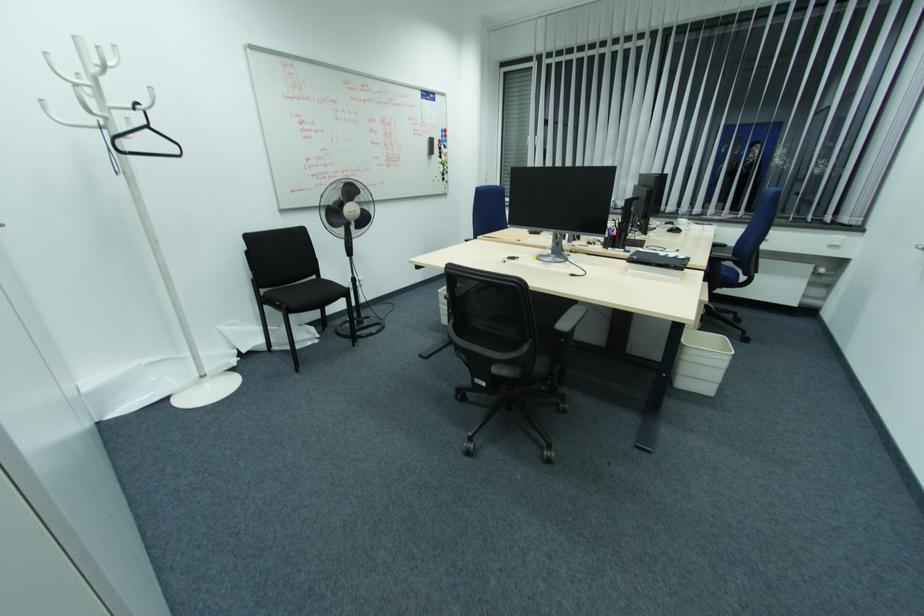
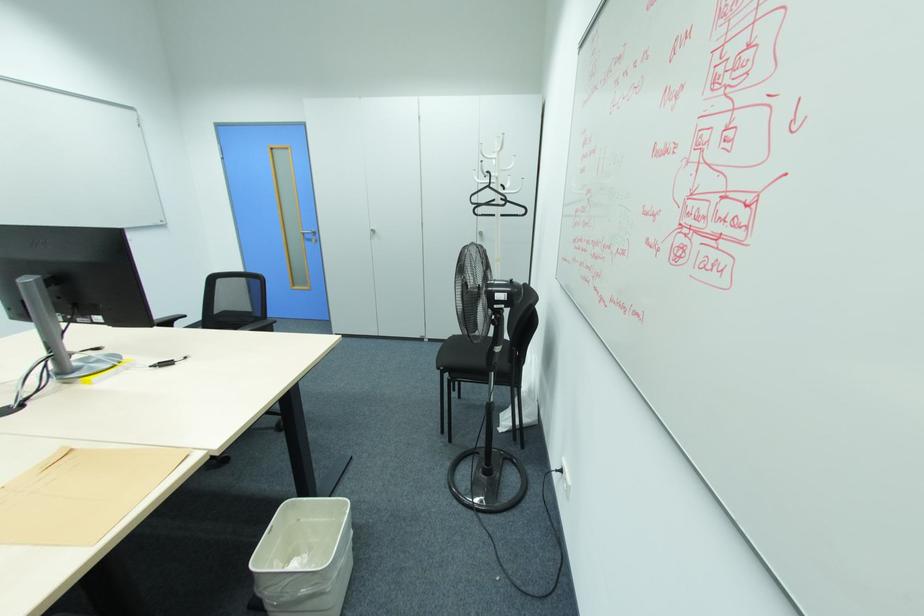
The point at (152,128) is marked in the first image. Where is the corresponding point in the second image?

(492, 185)